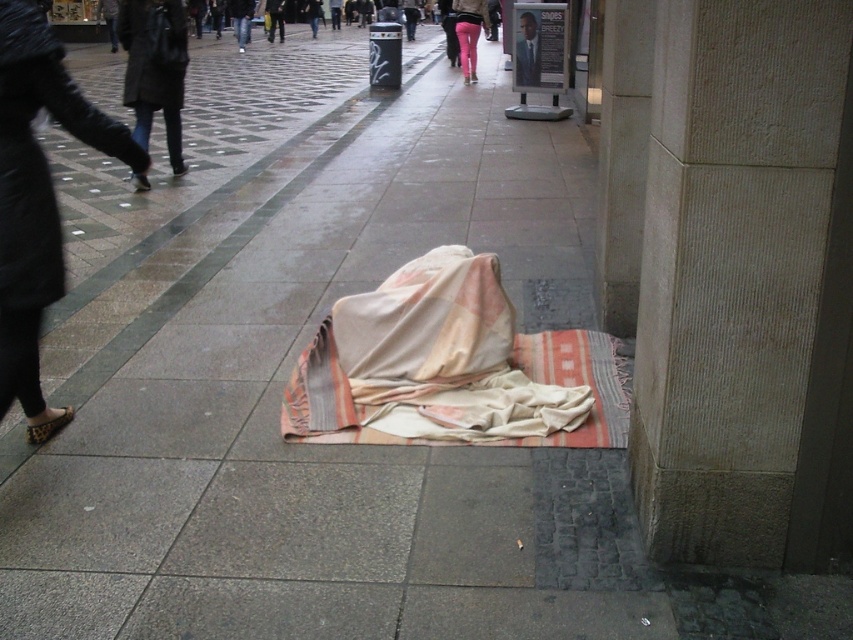
Who is more forward, (x=32, y=416) or (x=521, y=51)?

Point (x=32, y=416) is more forward.

The image size is (853, 640). I want to click on leather shoe at lower left, so click(38, 198).

Between pink fabric at lower center and smooth black suit at center, which one appears on the right side from the viewer's perspective?

From the viewer's perspective, smooth black suit at center appears more on the right side.

Does pink fabric at lower center have a lesser width compared to smooth black suit at center?

Incorrect, pink fabric at lower center's width is not less than smooth black suit at center's.

Locate an element on the screen. pink fabric at lower center is located at coordinates (469, 33).

Measure the distance from beige woven blanket at center to leather shoe at lower left.

beige woven blanket at center is 4.62 feet away from leather shoe at lower left.

Is beige woven blanket at center wider than leather shoe at lower left?

Yes, beige woven blanket at center is wider than leather shoe at lower left.

Does point (445, 388) lie behind point (1, 250)?

That is True.

The width and height of the screenshot is (853, 640). What are the coordinates of `beige woven blanket at center` in the screenshot? It's located at (451, 368).